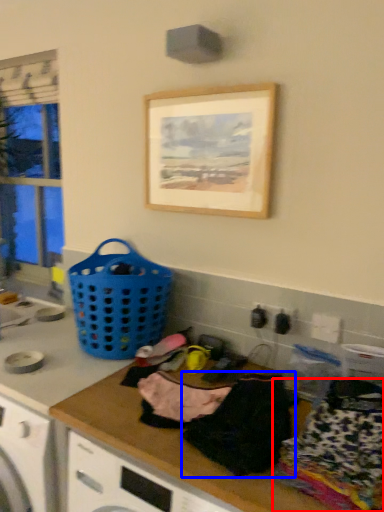
Question: Which of the following is the closest to the observer, clothing (highlighted by a red box) or clothing (highlighted by a blue box)?

Choices:
 (A) clothing
 (B) clothing

Answer: (A)